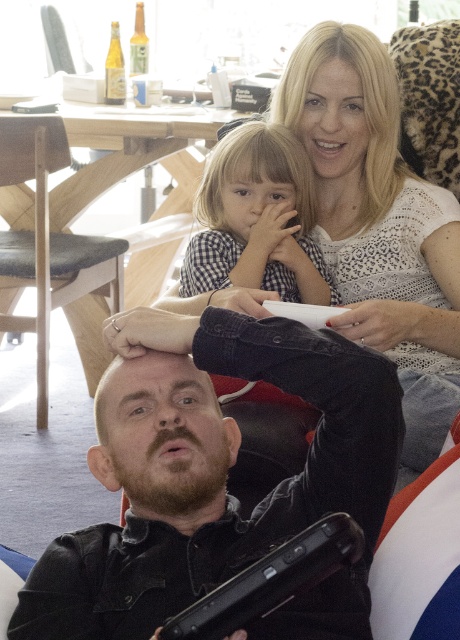
Question: Does checkered fabric dress at center have a lesser width compared to light brown wooden chair at left?

Choices:
 (A) yes
 (B) no

Answer: (A)

Question: Which point is farther to the camera?

Choices:
 (A) dark brown leather jacket at lower left
 (B) light brown wooden chair at left
 (C) checkered fabric dress at center

Answer: (B)

Question: Does dark brown leather jacket at lower left have a smaller size compared to light brown wooden chair at left?

Choices:
 (A) yes
 (B) no

Answer: (A)

Question: Which of the following is the closest to the observer?

Choices:
 (A) light brown wooden chair at left
 (B) checkered fabric dress at center

Answer: (B)

Question: Which object appears closest to the camera in this image?

Choices:
 (A) dark brown leather jacket at lower left
 (B) checkered fabric dress at center

Answer: (A)

Question: Does dark brown leather jacket at lower left have a greater width compared to light brown wooden chair at left?

Choices:
 (A) no
 (B) yes

Answer: (B)